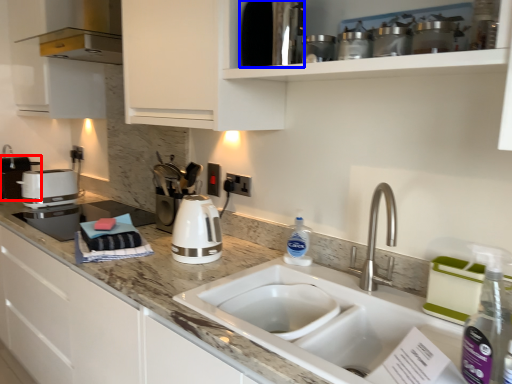
Question: Among these objects, which one is farthest to the camera, appliance (highlighted by a red box) or appliance (highlighted by a blue box)?

Choices:
 (A) appliance
 (B) appliance

Answer: (A)